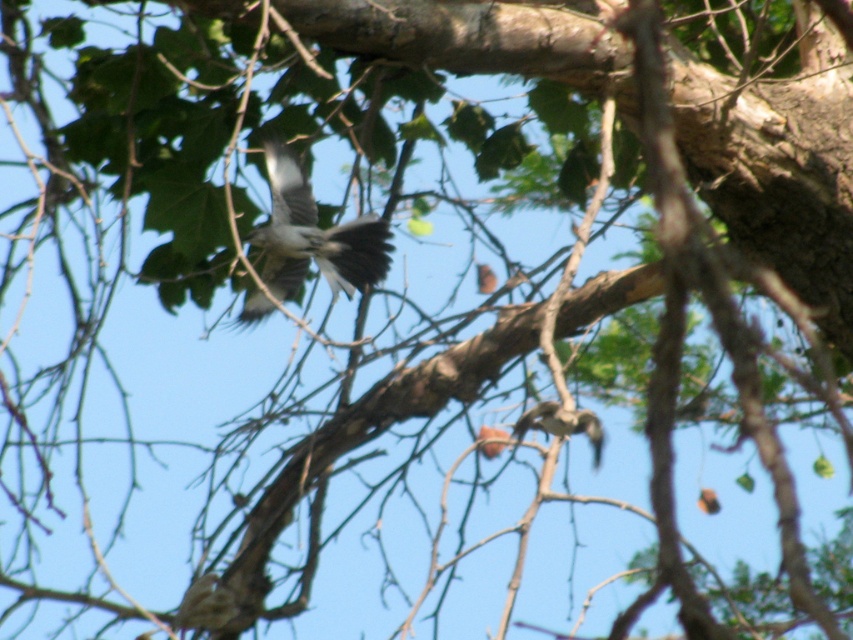
You are an ornithologist observing a tree. You see a gray feathered bird at center and a brown speckled feather at lower right. Which object is closer to you?

The gray feathered bird at center is closer to you because it is further to the viewer than the brown speckled feather at lower right.

You are a birdwatcher observing the scene. You notice the gray feathered bird at center and the brown speckled feather at lower right. Which object is taller in the image?

The gray feathered bird at center is taller than the brown speckled feather at lower right.